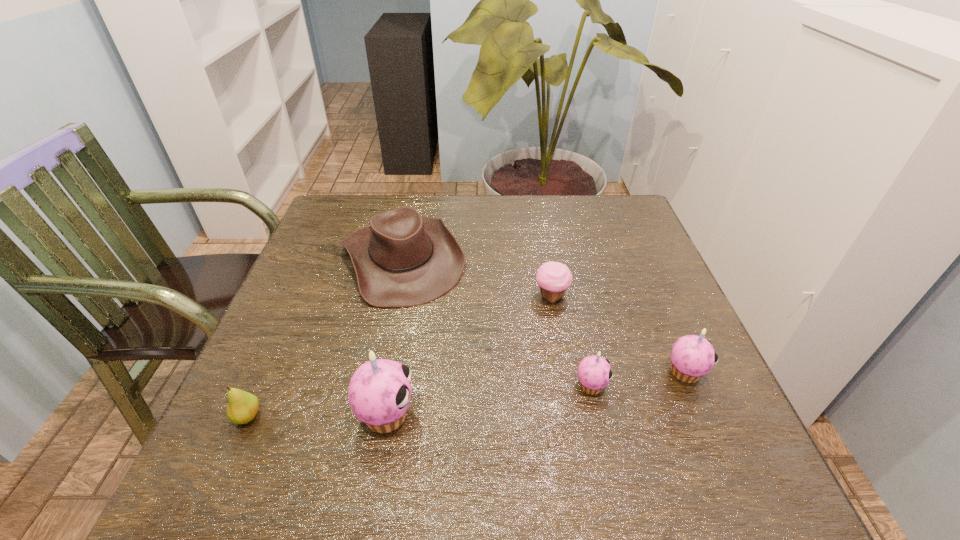
Image resolution: width=960 pixels, height=540 pixels. In order to click on the tallest object in this screenshot , I will do `click(379, 393)`.

I want to click on the leftmost cupcake, so click(x=379, y=393).

The width and height of the screenshot is (960, 540). What are the coordinates of `the second tallest cupcake` in the screenshot? It's located at (692, 357).

Locate an element on the screen. the rightmost cupcake is located at coordinates (692, 357).

Find the location of a particular element. This screenshot has height=540, width=960. cowboy hat is located at coordinates (402, 259).

Find the location of a particular element. The image size is (960, 540). the farthest cupcake is located at coordinates (553, 278).

Identify the location of the leftmost object. The height and width of the screenshot is (540, 960). (243, 406).

Identify the location of free space located on the face of the tallest object. (444, 414).

Find the location of `vacant region located on the back of the cowboy hat`. vacant region located on the back of the cowboy hat is located at coordinates (414, 206).

Locate an element on the screen. The width and height of the screenshot is (960, 540). free region located 0.370m on the back of the farthest cupcake is located at coordinates (535, 203).